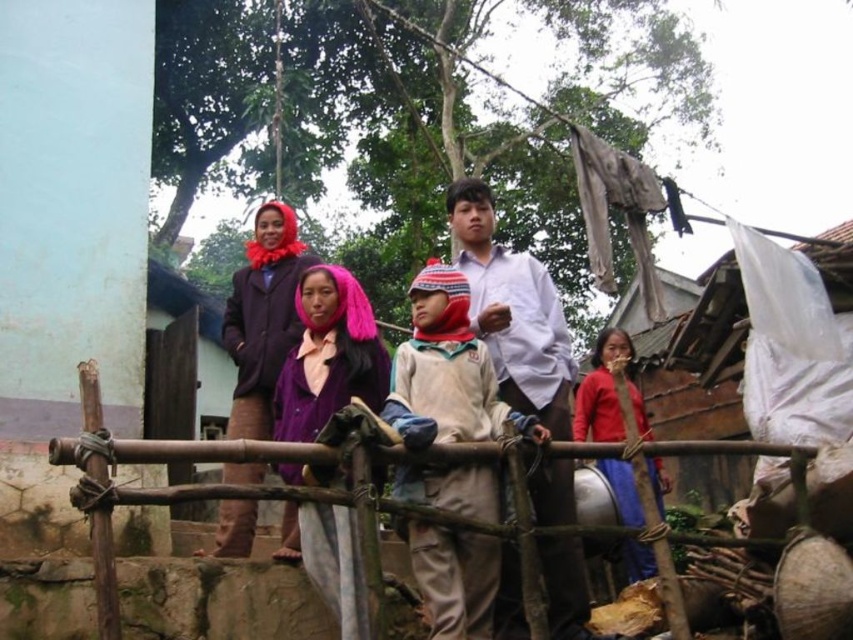
You are a photographer trying to capture a group photo of the scene. You notice the white cotton shirt at center and the matte purple dress at center. Which clothing item should you adjust to ensure both are fully visible in the photo?

The white cotton shirt at center is not as tall as the matte purple dress at center, so you should lower the camera angle slightly to ensure both are fully visible.